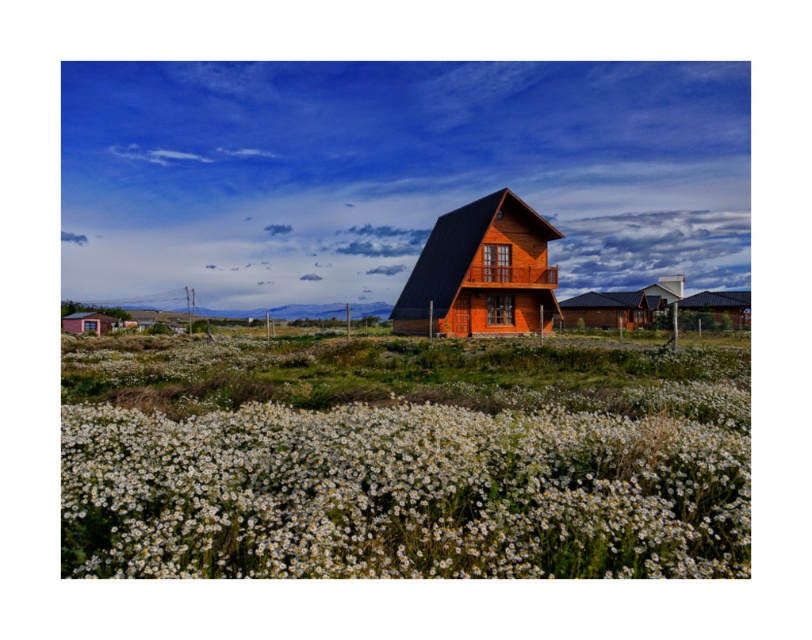
You are standing in the field of white daisies and want to take a photo of the wooden cabin at right. To get the best shot, you need to ensure the white fluffy petals at lower center are visible in the foreground. Based on their positions, is this possible?

Yes, the white fluffy petals at lower center are located below the wooden cabin at right, so positioning yourself in the field of daisies will allow the petals to appear in the foreground while capturing the cabin in the background.